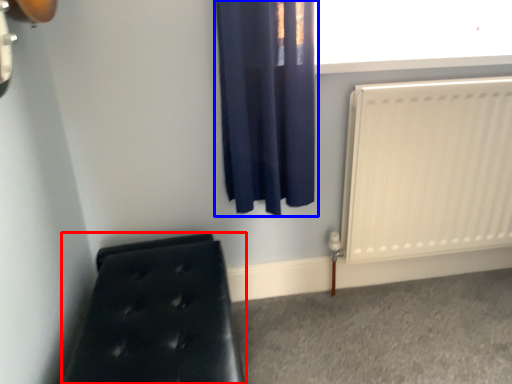
Question: Which object appears closest to the camera in this image, furniture (highlighted by a red box) or curtain (highlighted by a blue box)?

Choices:
 (A) furniture
 (B) curtain

Answer: (A)